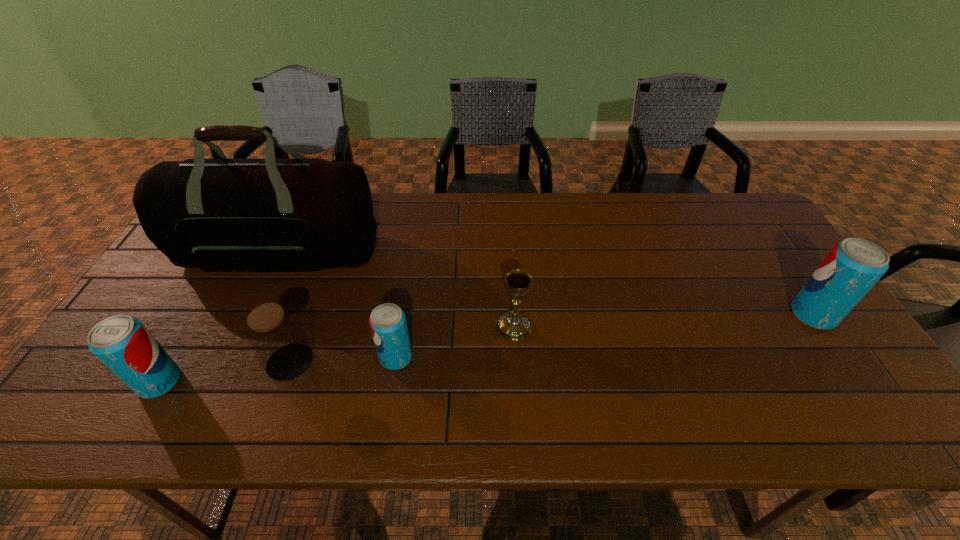
Where is `unoccupied area between the leftmost soda can and the rightmost soda can`? Image resolution: width=960 pixels, height=540 pixels. unoccupied area between the leftmost soda can and the rightmost soda can is located at coordinates (487, 348).

This screenshot has width=960, height=540. I want to click on vacant area that lies between the farthest soda can and the jar, so click(551, 339).

This screenshot has height=540, width=960. Find the location of `vacant space that's between the fifth object from left to right and the second shortest soda can`. vacant space that's between the fifth object from left to right and the second shortest soda can is located at coordinates (337, 354).

The width and height of the screenshot is (960, 540). Find the location of `vacant space that is in between the second shortest soda can and the jar`. vacant space that is in between the second shortest soda can and the jar is located at coordinates [x=225, y=372].

The image size is (960, 540). Find the location of `free spot between the second shortest soda can and the jar`. free spot between the second shortest soda can and the jar is located at coordinates (225, 372).

Find the location of a particular element. The width and height of the screenshot is (960, 540). object identified as the second closest to the second shortest soda can is located at coordinates (305, 214).

Locate which object is the fourth closest to the jar. Please provide its 2D coordinates. Your answer should be formatted as a tuple, i.e. [(x, y)], where the tuple contains the x and y coordinates of a point satisfying the conditions above.

[(512, 325)]

Locate which soda can is the closest to the second tallest soda can. Please provide its 2D coordinates. Your answer should be formatted as a tuple, i.e. [(x, y)], where the tuple contains the x and y coordinates of a point satisfying the conditions above.

[(388, 325)]

The height and width of the screenshot is (540, 960). I want to click on the closest soda can to the farthest soda can, so click(x=388, y=325).

Identify the location of free location that satisfies the following two spatial constraints: 1. on the back side of the second soda can from right to left; 2. on the left side of the jar. This screenshot has height=540, width=960. click(x=292, y=357).